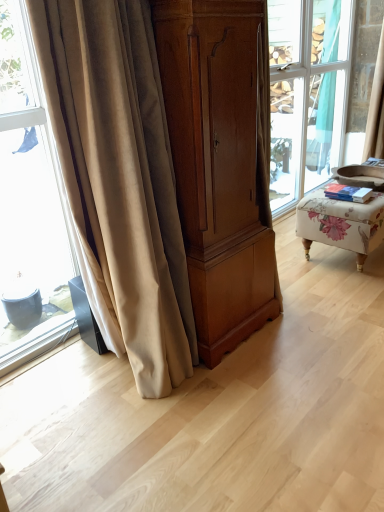
What are the coordinates of `free spot to the right of matte wood cabinet at center` in the screenshot? It's located at (314, 334).